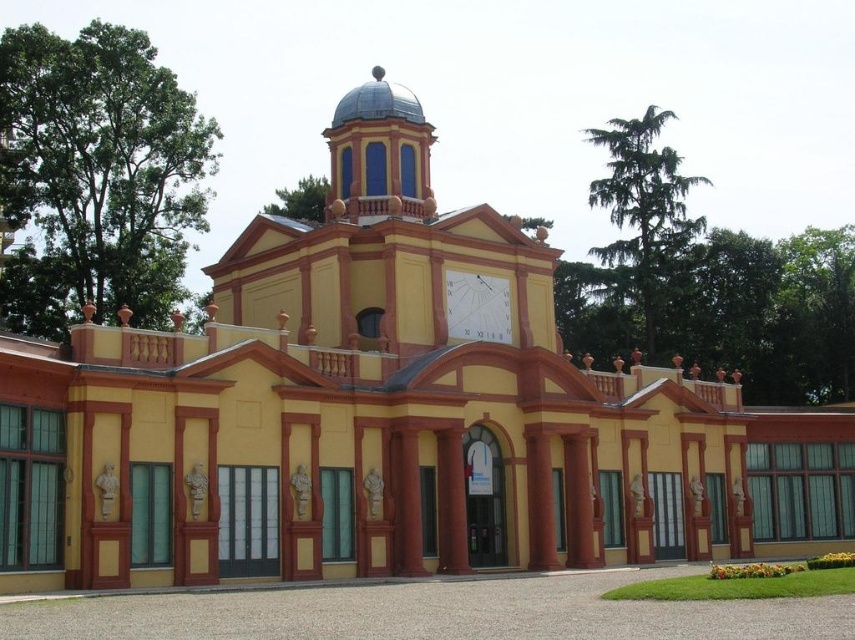
You are standing in front of the grand building and want to take a photo of the point at coordinates (351,164). If your camera has a maximum focus range of 60 meters, will you be able to focus on that point?

The point at coordinates (351,164) is 65.49 meters away from the camera, which exceeds the camera maximum focus range of 60 meters. Therefore, the camera cannot focus on that point.

You are standing in front of the grand building and want to know which of the two points, point (x=339, y=141) or point (x=447, y=269), is closer to you. Which one is it?

Point (x=339, y=141) is closer to you because it is further to the camera than point (x=447, y=269).

You are an architect designing a new building inspired by the image. You want to ensure that the blue glass dome at center is proportionally larger than the white glossy clock at center. Does the current design meet this requirement based on the scene?

Yes, the blue glass dome at center is taller than the white glossy clock at center, so the current design meets the requirement of having the dome proportionally larger than the clock.